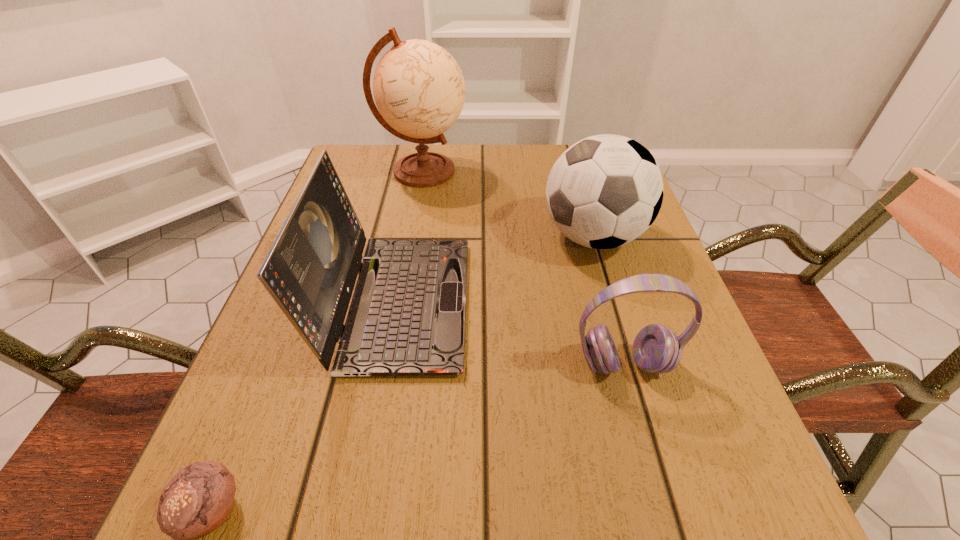
At what (x,y) coordinates should I click in order to perform the action: click on the tallest object. Please return your answer as a coordinate pair (x, y). The image size is (960, 540). Looking at the image, I should click on click(419, 89).

Locate an element on the screen. globe is located at coordinates (419, 89).

Where is `laptop computer`? The height and width of the screenshot is (540, 960). laptop computer is located at coordinates (407, 316).

Find the location of `soccer ball`. soccer ball is located at coordinates (604, 191).

I want to click on headset, so click(x=656, y=349).

This screenshot has height=540, width=960. Find the location of `vacant space located 0.080m on the surface of the tallest object`. vacant space located 0.080m on the surface of the tallest object is located at coordinates (498, 171).

I want to click on vacant space positioned 0.090m on the screen of the laptop computer, so click(x=516, y=302).

You are a GUI agent. You are given a task and a screenshot of the screen. Output one action in this format:
    pyautogui.click(x=<x>, y=<y>)
    Task: Click on the vacant point located on the main logo of the soccer ball
    Image resolution: width=960 pixels, height=540 pixels.
    Given the screenshot: What is the action you would take?
    pyautogui.click(x=392, y=237)

Locate an element on the screen. free location located on the main logo of the soccer ball is located at coordinates (359, 237).

Locate an element on the screen. vacant region located 0.100m on the main logo of the soccer ball is located at coordinates (494, 237).